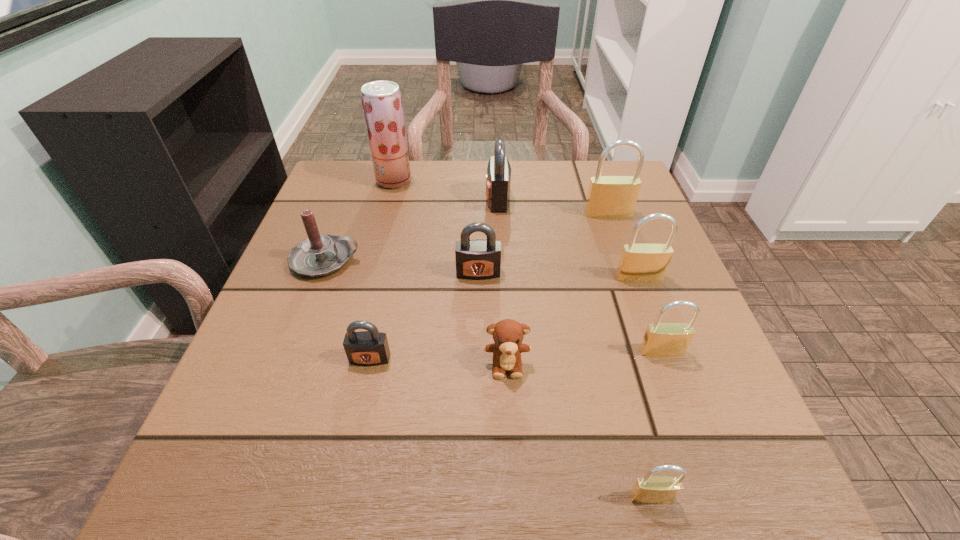
Identify which brass padlock is the third closest to the fruit juice. Please provide its 2D coordinates. Your answer should be formatted as a tuple, i.e. [(x, y)], where the tuple contains the x and y coordinates of a point satisfying the conditions above.

[(661, 339)]

Identify which brass padlock is the second closest to the biggest brass padlock. Please provide its 2D coordinates. Your answer should be formatted as a tuple, i.e. [(x, y)], where the tuple contains the x and y coordinates of a point satisfying the conditions above.

[(661, 339)]

Identify which gray padlock is the second nearest to the teddy bear. Please provide its 2D coordinates. Your answer should be formatted as a tuple, i.e. [(x, y)], where the tuple contains the x and y coordinates of a point satisfying the conditions above.

[(478, 259)]

This screenshot has width=960, height=540. I want to click on the second closest gray padlock relative to the third farthest brass padlock, so click(364, 348).

The height and width of the screenshot is (540, 960). I want to click on vacant space that satisfies the following two spatial constraints: 1. on the front-facing side of the farthest brass padlock; 2. on the side of the candle with the handle loop, so click(x=624, y=260).